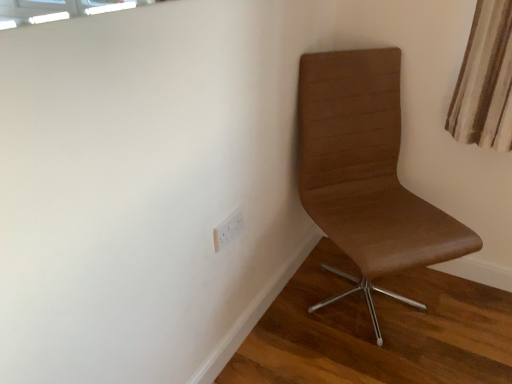
What do you see at coordinates (366, 171) in the screenshot?
I see `brown leather chair at right` at bounding box center [366, 171].

Locate an element on the screen. brown leather chair at right is located at coordinates (366, 171).

I want to click on white plastic electric outlet at lower center, so click(228, 230).

The height and width of the screenshot is (384, 512). What do you see at coordinates (228, 230) in the screenshot?
I see `white plastic electric outlet at lower center` at bounding box center [228, 230].

Locate an element on the screen. The image size is (512, 384). brown leather chair at right is located at coordinates (366, 171).

Is white plastic electric outlet at lower center to the left of brown leather chair at right from the viewer's perspective?

Yes, white plastic electric outlet at lower center is to the left of brown leather chair at right.

Considering the positions of objects white plastic electric outlet at lower center and brown leather chair at right in the image provided, who is in front, white plastic electric outlet at lower center or brown leather chair at right?

brown leather chair at right.

Does point (240, 224) come farther from viewer compared to point (393, 271)?

Yes, point (240, 224) is farther from viewer.

From the image's perspective, which is above, white plastic electric outlet at lower center or brown leather chair at right?

From the image's view, brown leather chair at right is above.

From a real-world perspective, is white plastic electric outlet at lower center located beneath brown leather chair at right?

Actually, white plastic electric outlet at lower center is physically above brown leather chair at right in the real world.

Consider the image. Which of these two, white plastic electric outlet at lower center or brown leather chair at right, is wider?

brown leather chair at right is wider.

Who is shorter, white plastic electric outlet at lower center or brown leather chair at right?

white plastic electric outlet at lower center.

Does white plastic electric outlet at lower center have a smaller size compared to brown leather chair at right?

Yes.

Would you say white plastic electric outlet at lower center is inside or outside brown leather chair at right?

white plastic electric outlet at lower center lies outside brown leather chair at right.

Based on the photo, is white plastic electric outlet at lower center next to brown leather chair at right?

white plastic electric outlet at lower center and brown leather chair at right are not in contact.

Is white plastic electric outlet at lower center aimed at brown leather chair at right?

No, white plastic electric outlet at lower center is not facing towards brown leather chair at right.

From the picture: Measure the distance from white plastic electric outlet at lower center to brown leather chair at right.

20.82 inches.

This screenshot has height=384, width=512. Identify the location of chair that is on the right side of white plastic electric outlet at lower center. (366, 171).

Between brown leather chair at right and white plastic electric outlet at lower center, which one appears on the right side from the viewer's perspective?

brown leather chair at right is more to the right.

Is the position of brown leather chair at right less distant than that of white plastic electric outlet at lower center?

Yes, brown leather chair at right is closer to the camera.

Is point (336, 131) closer to viewer compared to point (216, 247)?

That is False.

Consider the image. From the image's perspective, which object appears higher, brown leather chair at right or white plastic electric outlet at lower center?

brown leather chair at right is shown above in the image.

From a real-world perspective, does brown leather chair at right sit lower than white plastic electric outlet at lower center?

Yes, from a real-world perspective, brown leather chair at right is beneath white plastic electric outlet at lower center.

Considering the relative sizes of brown leather chair at right and white plastic electric outlet at lower center in the image provided, is brown leather chair at right wider than white plastic electric outlet at lower center?

Yes, brown leather chair at right is wider than white plastic electric outlet at lower center.

Is brown leather chair at right taller than white plastic electric outlet at lower center?

Correct, brown leather chair at right is much taller as white plastic electric outlet at lower center.

Considering the relative sizes of brown leather chair at right and white plastic electric outlet at lower center in the image provided, is brown leather chair at right smaller than white plastic electric outlet at lower center?

Incorrect, brown leather chair at right is not smaller in size than white plastic electric outlet at lower center.

Is brown leather chair at right positioned beyond the bounds of white plastic electric outlet at lower center?

Absolutely, brown leather chair at right is external to white plastic electric outlet at lower center.

Is brown leather chair at right touching white plastic electric outlet at lower center?

They are not placed beside each other.

Is brown leather chair at right oriented towards white plastic electric outlet at lower center?

No.

Measure the distance from brown leather chair at right to white plastic electric outlet at lower center.

brown leather chair at right is 20.82 inches from white plastic electric outlet at lower center.

The width and height of the screenshot is (512, 384). I want to click on chair lying on the right of white plastic electric outlet at lower center, so click(366, 171).

The image size is (512, 384). I want to click on chair below the white plastic electric outlet at lower center (from a real-world perspective), so click(x=366, y=171).

The height and width of the screenshot is (384, 512). Identify the location of chair on the right of white plastic electric outlet at lower center. (366, 171).